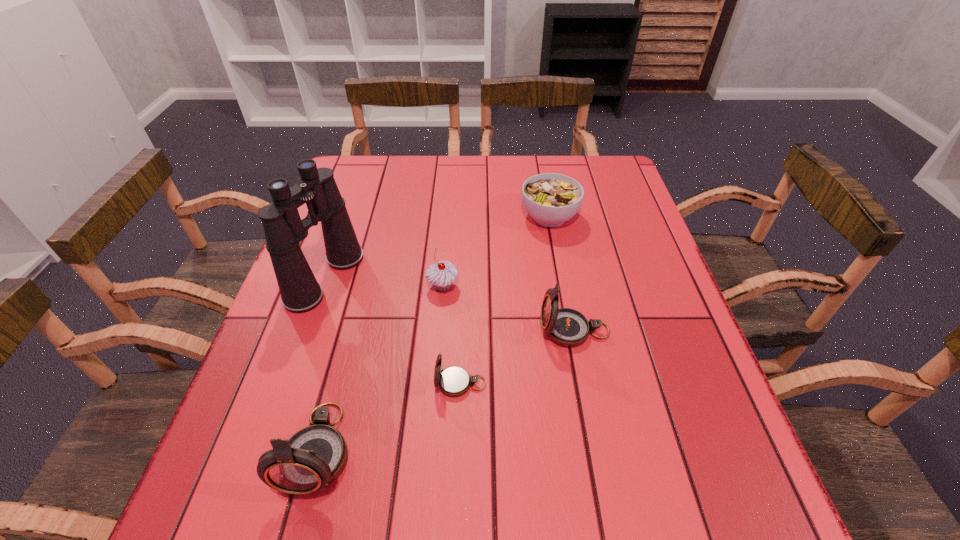
Where is `vacant point located between the third tallest object and the second compass from right to left`? vacant point located between the third tallest object and the second compass from right to left is located at coordinates (517, 357).

This screenshot has width=960, height=540. I want to click on blank region between the second tallest compass and the third shortest object, so click(x=509, y=308).

Identify the location of vacant area that lies between the fourth tallest object and the rightmost compass. The image size is (960, 540). pos(509,308).

The width and height of the screenshot is (960, 540). I want to click on free space between the farthest object and the leftmost compass, so click(x=434, y=333).

The image size is (960, 540). In order to click on free area in between the leftmost compass and the second nearest object in this screenshot , I will do `click(390, 416)`.

I want to click on free space that is in between the second farthest compass and the farthest compass, so click(517, 357).

Locate an element on the screen. vacant area that lies between the binoculars and the third shortest object is located at coordinates (384, 282).

Image resolution: width=960 pixels, height=540 pixels. I want to click on free space between the third shortest object and the shortest compass, so click(x=451, y=335).

Identify which object is the third nearest to the farthest compass. Please provide its 2D coordinates. Your answer should be formatted as a tuple, i.e. [(x, y)], where the tuple contains the x and y coordinates of a point satisfying the conditions above.

[(551, 199)]

Select which object appears as the closest to the shortest compass. Please provide its 2D coordinates. Your answer should be formatted as a tuple, i.e. [(x, y)], where the tuple contains the x and y coordinates of a point satisfying the conditions above.

[(567, 327)]